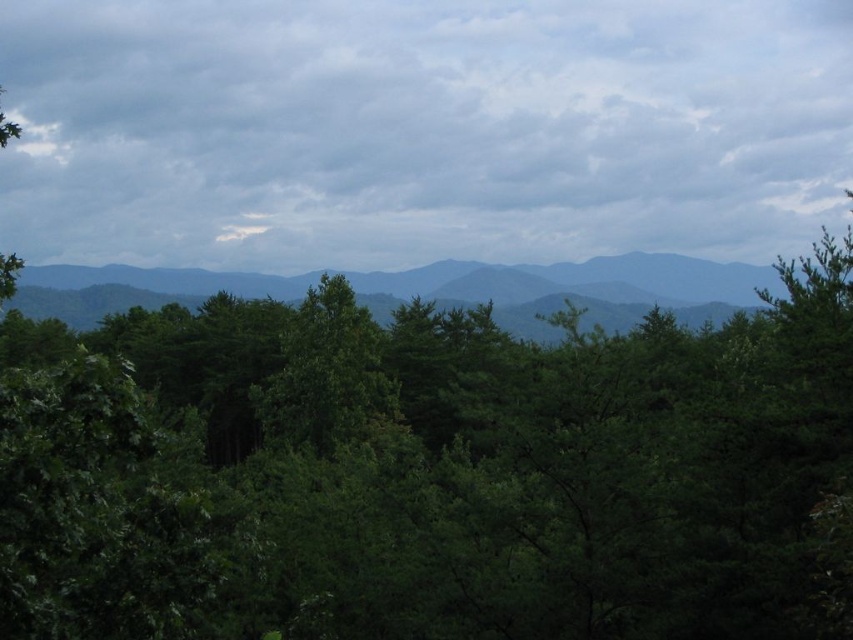
Question: Which object is the closest to the cloudy sky at upper center?

Choices:
 (A) green leafy forest at center
 (B) green leafy tree at center

Answer: (A)

Question: Can you confirm if cloudy sky at upper center is positioned to the right of green leafy forest at center?

Choices:
 (A) yes
 (B) no

Answer: (A)

Question: Can you confirm if green leafy tree at center is positioned to the left of cloudy sky at upper center?

Choices:
 (A) no
 (B) yes

Answer: (A)

Question: Which is nearer to the cloudy sky at upper center?

Choices:
 (A) green leafy forest at center
 (B) green leafy tree at center

Answer: (A)

Question: Which point is closer to the camera?

Choices:
 (A) (508, 621)
 (B) (54, 104)

Answer: (A)

Question: Can you confirm if green leafy tree at center is positioned to the right of cloudy sky at upper center?

Choices:
 (A) no
 (B) yes

Answer: (B)